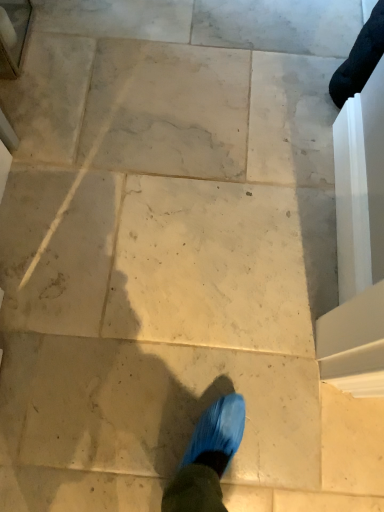
What do you see at coordinates (154, 407) in the screenshot?
I see `beige marble floor at center` at bounding box center [154, 407].

In order to face beige marble floor at center, should I rotate leftwards or rightwards?

Rotate your view left by about 1.187°.

Identify the location of beige marble floor at center. (154, 407).

The width and height of the screenshot is (384, 512). Find the location of `beige marble floor at center`. beige marble floor at center is located at coordinates (154, 407).